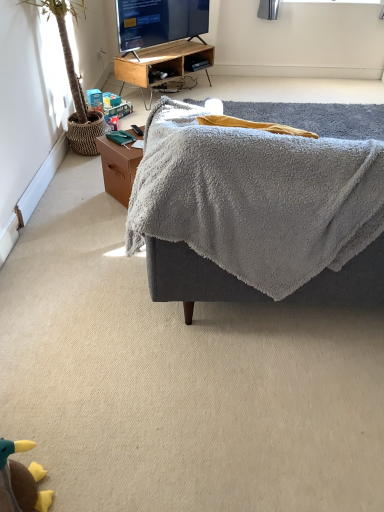
Where is `free space to the right of plush yellow duck at lower left`? The height and width of the screenshot is (512, 384). free space to the right of plush yellow duck at lower left is located at coordinates (85, 477).